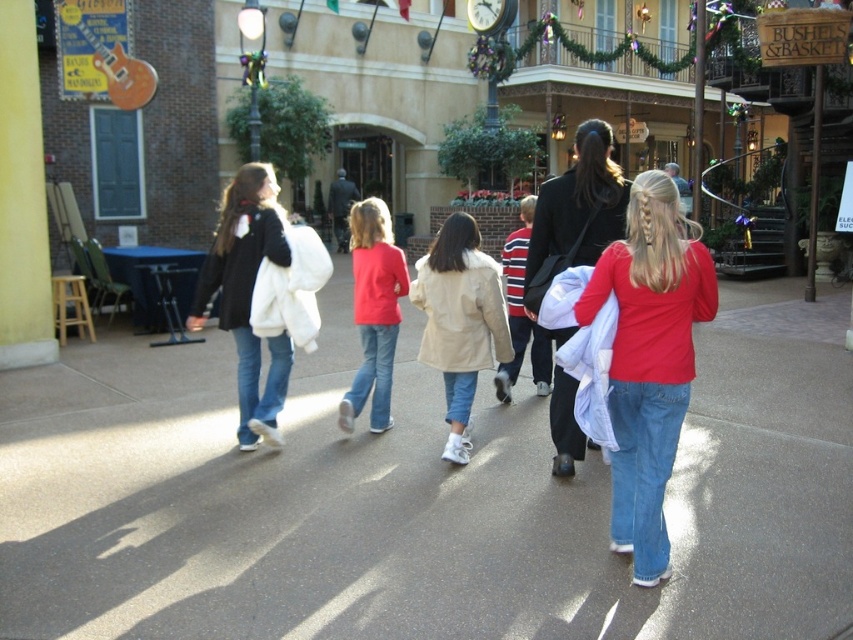
Measure the distance from beige fur-trimmed coat at center to matte red sweater at center.

beige fur-trimmed coat at center is 1.05 meters away from matte red sweater at center.

Between point (433, 310) and point (352, 280), which one is positioned in front?

Point (433, 310)

At what (x,y) coordinates should I click in order to perform the action: click on beige fur-trimmed coat at center. Please return your answer as a coordinate pair (x, y). This screenshot has width=853, height=640. Looking at the image, I should click on (459, 321).

Where is `beige fur-trimmed coat at center`? This screenshot has width=853, height=640. beige fur-trimmed coat at center is located at coordinates (459, 321).

Which is more to the right, matte red shirt at center or beige fur-trimmed coat at center?

From the viewer's perspective, matte red shirt at center appears more on the right side.

Between point (688, 310) and point (490, 275), which one is positioned in front?

Point (688, 310)

This screenshot has width=853, height=640. Find the location of `matte red shirt at center`. matte red shirt at center is located at coordinates (648, 358).

Based on the photo, is white fluffy coat at center wider than beige fur-trimmed coat at center?

Indeed, white fluffy coat at center has a greater width compared to beige fur-trimmed coat at center.

Identify the location of white fluffy coat at center. click(247, 296).

You are a GUI agent. You are given a task and a screenshot of the screen. Output one action in this format:
    pyautogui.click(x=<x>, y=<y>)
    Task: Click on the white fluffy coat at center
    The width and height of the screenshot is (853, 640).
    Given the screenshot: What is the action you would take?
    pyautogui.click(x=247, y=296)